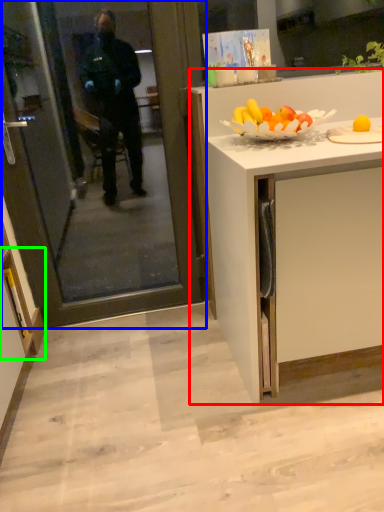
Question: Considering the real-world distances, which object is farthest from cabinetry (highlighted by a red box)? screen door (highlighted by a blue box) or cabinetry (highlighted by a green box)?

Choices:
 (A) screen door
 (B) cabinetry

Answer: (B)